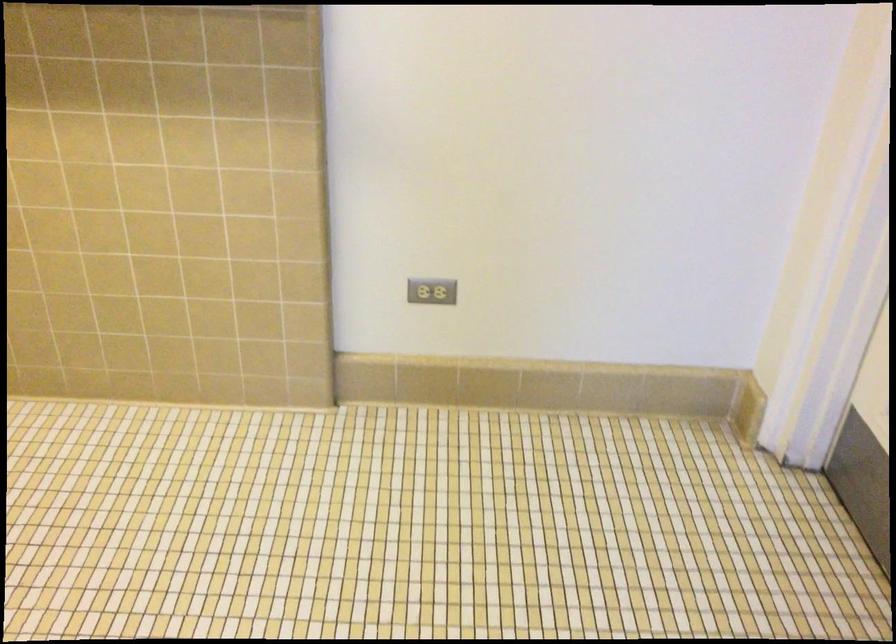
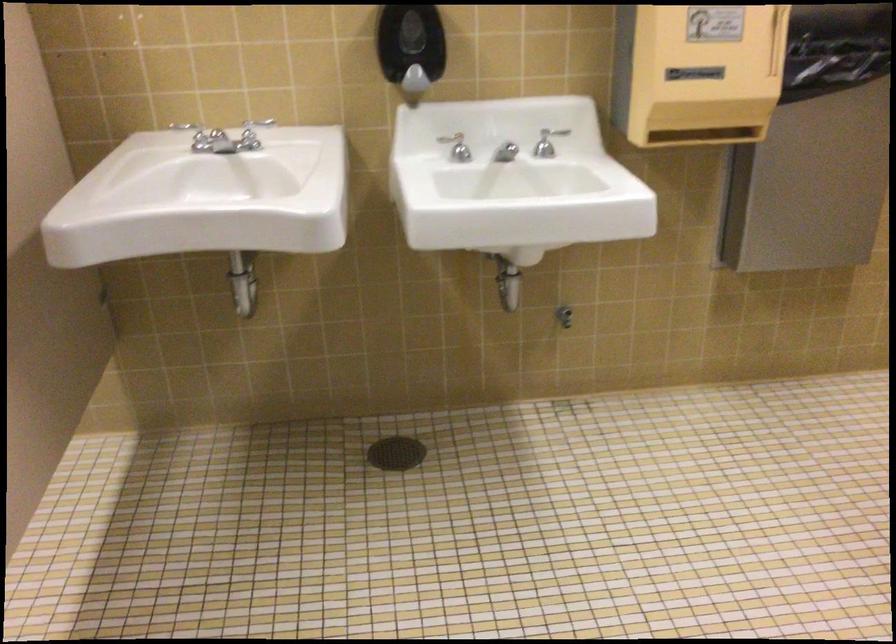
How did the camera likely rotate?

The camera rotated toward left-down.